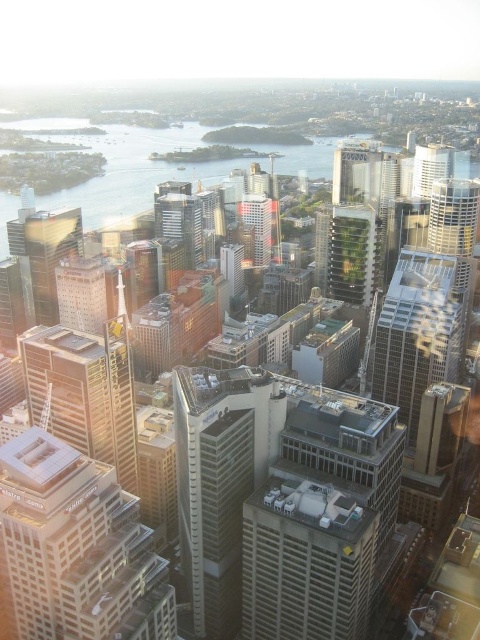
You are a GUI agent. You are given a task and a screenshot of the screen. Output one action in this format:
    pyautogui.click(x=<x>, y=<y>)
    Task: Click on the silver metallic skyscraper at center
    
    Given the screenshot: What is the action you would take?
    pyautogui.click(x=219, y=481)

In order to click on silver metallic skyscraper at center in this screenshot , I will do `click(219, 481)`.

At what (x,y) coordinates should I click in order to perform the action: click on silver metallic skyscraper at center. Please return your answer as a coordinate pair (x, y). Looking at the image, I should click on (219, 481).

Does white glass building at center come in front of silver glass tower at upper right?

Yes, white glass building at center is in front of silver glass tower at upper right.

Which of these two, white glass building at center or silver glass tower at upper right, stands taller?

silver glass tower at upper right is taller.

Which is behind, point (130, 552) or point (450, 218)?

The point (450, 218) is behind.

Identify the location of white glass building at center. (78, 547).

Is transparent glass water at center below matte glass skyscraper at center?

No, transparent glass water at center is not below matte glass skyscraper at center.

Is transparent glass water at center thinner than matte glass skyscraper at center?

In fact, transparent glass water at center might be wider than matte glass skyscraper at center.

Is point (116, 214) more distant than point (262, 241)?

That is True.

Identify the location of transparent glass water at center. (129, 168).